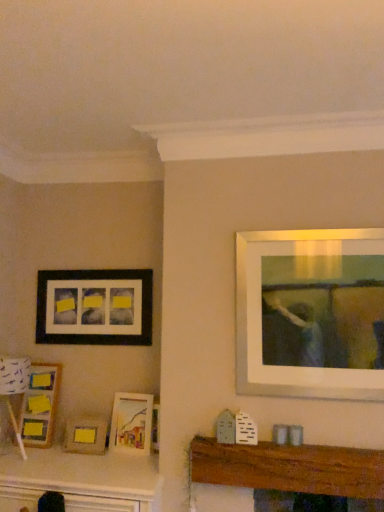
Question: Does matte black picture frame at left, which appears as the first picture frame when viewed from the top, have a greater width compared to wooden picture frame at lower left, which ranks as the 3th picture frame in bottom-to-top order?

Choices:
 (A) no
 (B) yes

Answer: (A)

Question: Considering the relative sizes of matte black picture frame at left, which appears as the first picture frame when viewed from the top, and wooden picture frame at lower left, which ranks as the 3th picture frame in bottom-to-top order, in the image provided, is matte black picture frame at left, which appears as the first picture frame when viewed from the top, thinner than wooden picture frame at lower left, which ranks as the 3th picture frame in bottom-to-top order,?

Choices:
 (A) no
 (B) yes

Answer: (B)

Question: Considering the relative sizes of matte black picture frame at left, placed as the fourth picture frame when sorted from bottom to top, and wooden picture frame at lower left, acting as the 2th picture frame starting from the top, in the image provided, is matte black picture frame at left, placed as the fourth picture frame when sorted from bottom to top, bigger than wooden picture frame at lower left, acting as the 2th picture frame starting from the top,?

Choices:
 (A) yes
 (B) no

Answer: (B)

Question: Can you confirm if matte black picture frame at left, which appears as the first picture frame when viewed from the top, is taller than wooden picture frame at lower left, which ranks as the 3th picture frame in bottom-to-top order?

Choices:
 (A) yes
 (B) no

Answer: (B)

Question: From a real-world perspective, is matte black picture frame at left, placed as the fourth picture frame when sorted from bottom to top, positioned under wooden picture frame at lower left, acting as the 2th picture frame starting from the top, based on gravity?

Choices:
 (A) no
 (B) yes

Answer: (A)

Question: Is wooden mantel at center bigger or smaller than matte wooden picture frame at center, acting as the 3th picture frame starting from the top?

Choices:
 (A) small
 (B) big

Answer: (B)

Question: From the image's perspective, is wooden mantel at center located above or below matte wooden picture frame at center, acting as the 3th picture frame starting from the top?

Choices:
 (A) below
 (B) above

Answer: (A)

Question: Relative to matte wooden picture frame at center, the 2th picture frame when ordered from bottom to top, is wooden mantel at center in front or behind?

Choices:
 (A) behind
 (B) front

Answer: (B)

Question: From a real-world perspective, is wooden mantel at center physically located above or below matte wooden picture frame at center, acting as the 3th picture frame starting from the top?

Choices:
 (A) below
 (B) above

Answer: (A)

Question: Is wooden mantel at center taller or shorter than matte yellow picture frame at lower left, placed as the 1th picture frame when sorted from bottom to top?

Choices:
 (A) tall
 (B) short

Answer: (A)

Question: Considering the positions of wooden mantel at center and matte yellow picture frame at lower left, placed as the 1th picture frame when sorted from bottom to top, in the image, is wooden mantel at center wider or thinner than matte yellow picture frame at lower left, placed as the 1th picture frame when sorted from bottom to top,?

Choices:
 (A) wide
 (B) thin

Answer: (B)

Question: From the image's perspective, is wooden mantel at center above or below matte yellow picture frame at lower left, the 4th picture frame positioned from the top?

Choices:
 (A) below
 (B) above

Answer: (A)

Question: Is wooden mantel at center in front of or behind matte yellow picture frame at lower left, the 4th picture frame positioned from the top, in the image?

Choices:
 (A) behind
 (B) front

Answer: (B)

Question: From their relative heights in the image, would you say white paper lampshade at lower left is taller or shorter than wooden picture frame at lower left, acting as the 2th picture frame starting from the top?

Choices:
 (A) tall
 (B) short

Answer: (A)

Question: In terms of size, does white paper lampshade at lower left appear bigger or smaller than wooden picture frame at lower left, acting as the 2th picture frame starting from the top?

Choices:
 (A) small
 (B) big

Answer: (B)